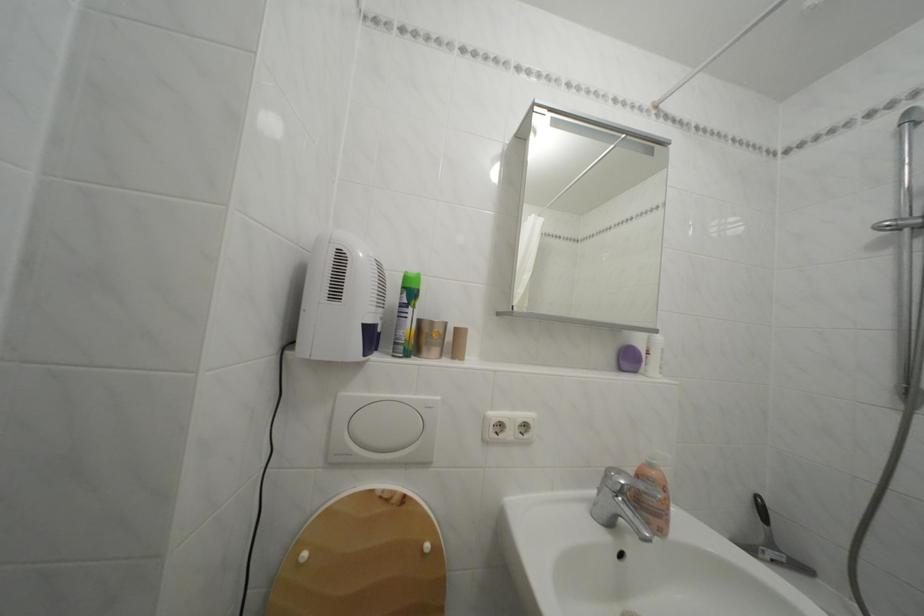
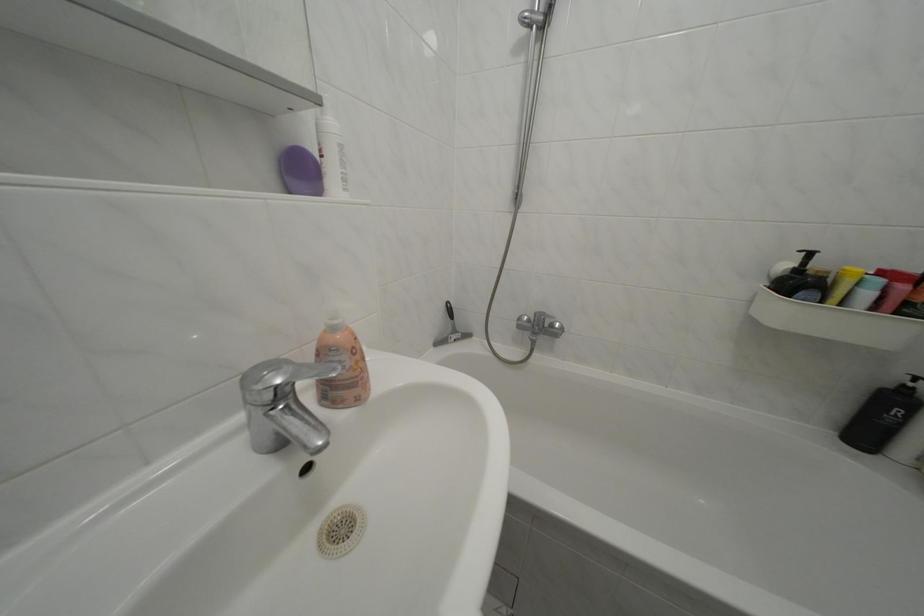
In the second image, find the point that corresponds to the point at 660,472 in the first image.

(342, 334)